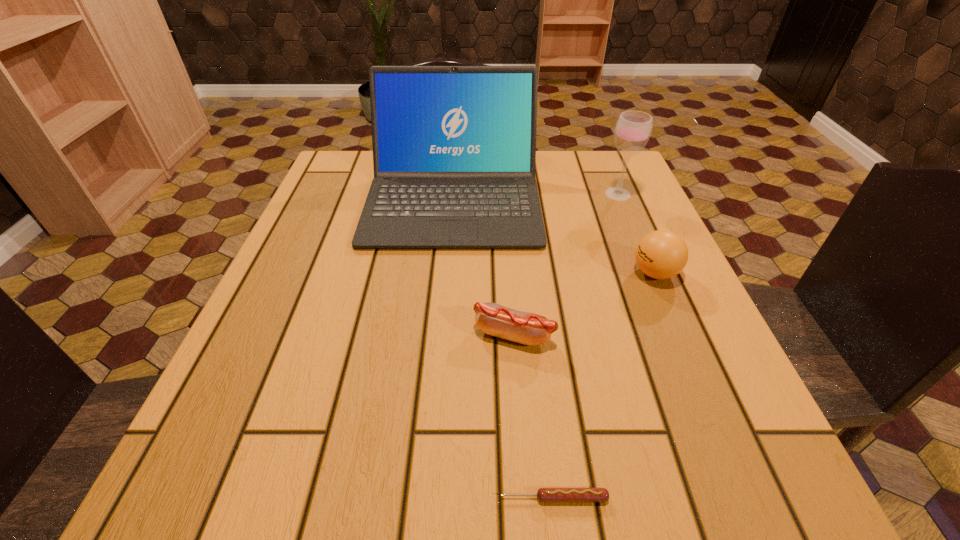
Where is `ping-pong ball located at the right edge`? The image size is (960, 540). ping-pong ball located at the right edge is located at coordinates (662, 254).

At what (x,y) coordinates should I click in order to perform the action: click on object at the far left corner. Please return your answer as a coordinate pair (x, y). Looking at the image, I should click on (454, 147).

The width and height of the screenshot is (960, 540). Identify the location of object that is at the far right corner. (633, 129).

Identify the location of vacant space at the near edge of the desktop. Image resolution: width=960 pixels, height=540 pixels. click(x=393, y=494).

Where is `blank space at the left edge of the desktop`? The width and height of the screenshot is (960, 540). blank space at the left edge of the desktop is located at coordinates (308, 256).

I want to click on free space at the right edge of the desktop, so click(603, 280).

Find the location of a particular element. The height and width of the screenshot is (540, 960). vacant space at the far left corner is located at coordinates (343, 151).

In the image, there is a desktop. What are the coordinates of `blank space at the near left corner` in the screenshot? It's located at (248, 504).

Where is `vacant space at the far right corner of the desktop`? The height and width of the screenshot is (540, 960). vacant space at the far right corner of the desktop is located at coordinates (640, 197).

Find the location of a particular element. free space at the near right corner is located at coordinates (682, 490).